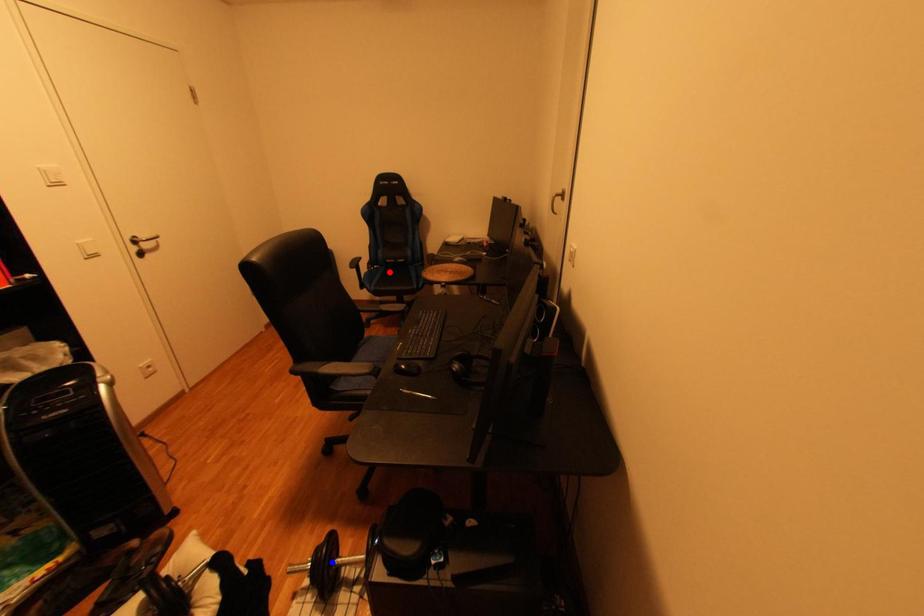
Question: In the image, two points are highlighted. Which point is nearer to the camera? Reply with the corresponding letter.

Choices:
 (A) blue point
 (B) red point

Answer: (A)